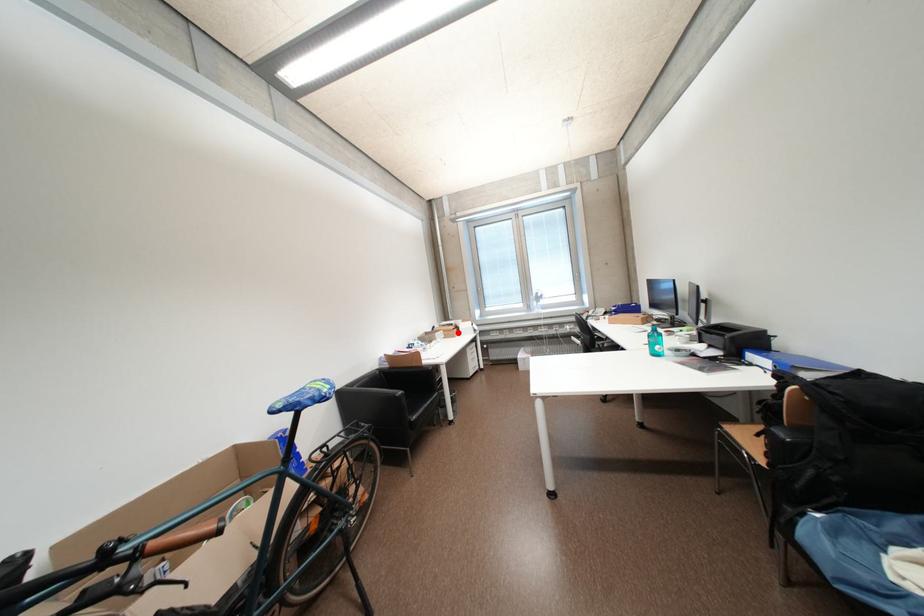
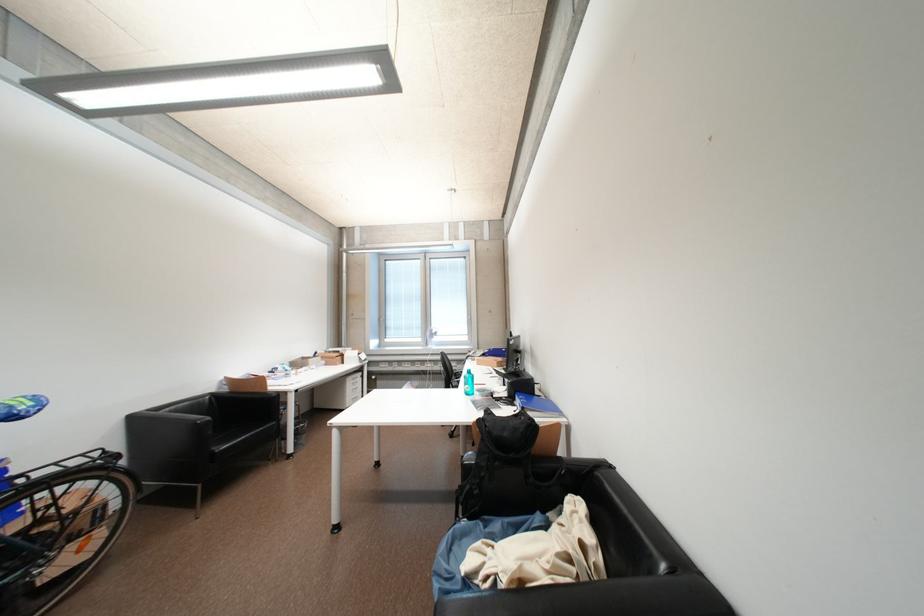
Locate, in the second image, the point that corresponds to the highlighted location in the first image.

(341, 360)